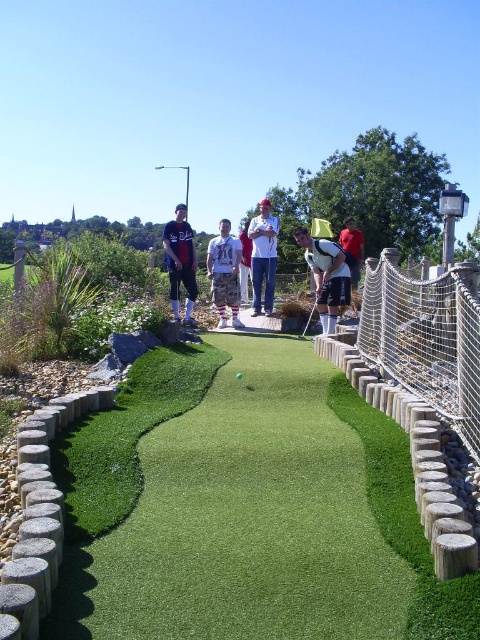
Question: Considering the relative positions of camo pants at center and shiny black golf club at center in the image provided, where is camo pants at center located with respect to shiny black golf club at center?

Choices:
 (A) above
 (B) below

Answer: (A)

Question: Is green artificial turf at center to the right of white matte golf club at center from the viewer's perspective?

Choices:
 (A) no
 (B) yes

Answer: (A)

Question: Based on their relative distances, which object is nearer to the shiny black golf club at center?

Choices:
 (A) red shirt at center
 (B) white matte golf club at center

Answer: (B)

Question: Which point is closer to the camera?

Choices:
 (A) shiny black golf club at center
 (B) white matte golf club at center

Answer: (B)

Question: Among these objects, which one is farthest from the camera?

Choices:
 (A) white cotton shirt at center
 (B) camo pants at center
 (C) white matte golf club at center

Answer: (A)

Question: Is green artificial turf at center closer to the viewer compared to red shirt at center?

Choices:
 (A) no
 (B) yes

Answer: (B)